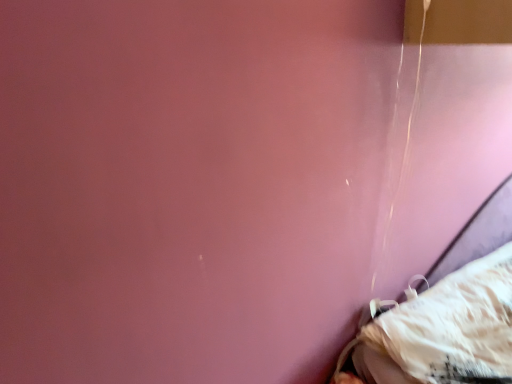
The image size is (512, 384). Identify the location of white fabric at lower right. (453, 326).

The width and height of the screenshot is (512, 384). Describe the element at coordinates (453, 326) in the screenshot. I see `white fabric at lower right` at that location.

At what (x,y) coordinates should I click in order to perform the action: click on white fabric at lower right. Please return your answer as a coordinate pair (x, y). Looking at the image, I should click on (453, 326).